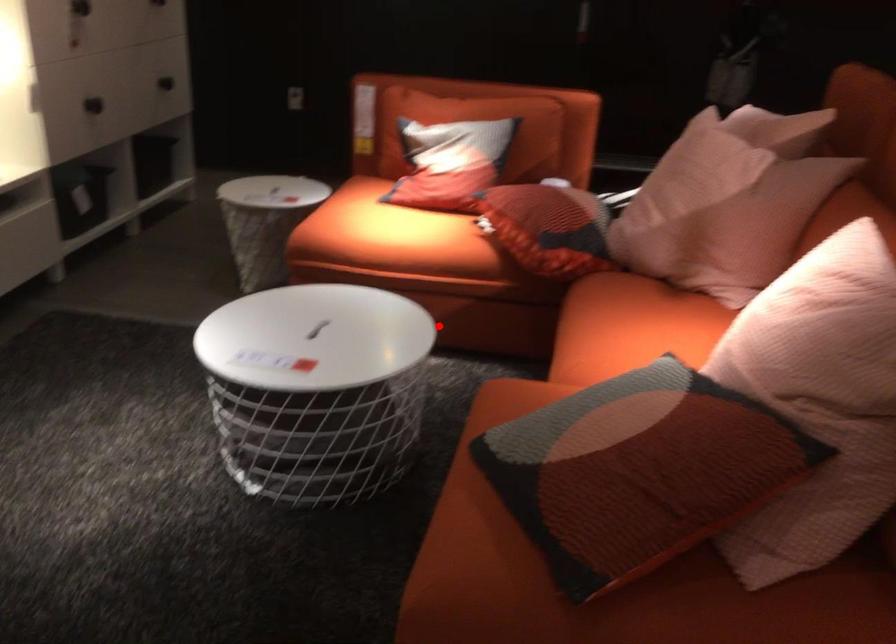
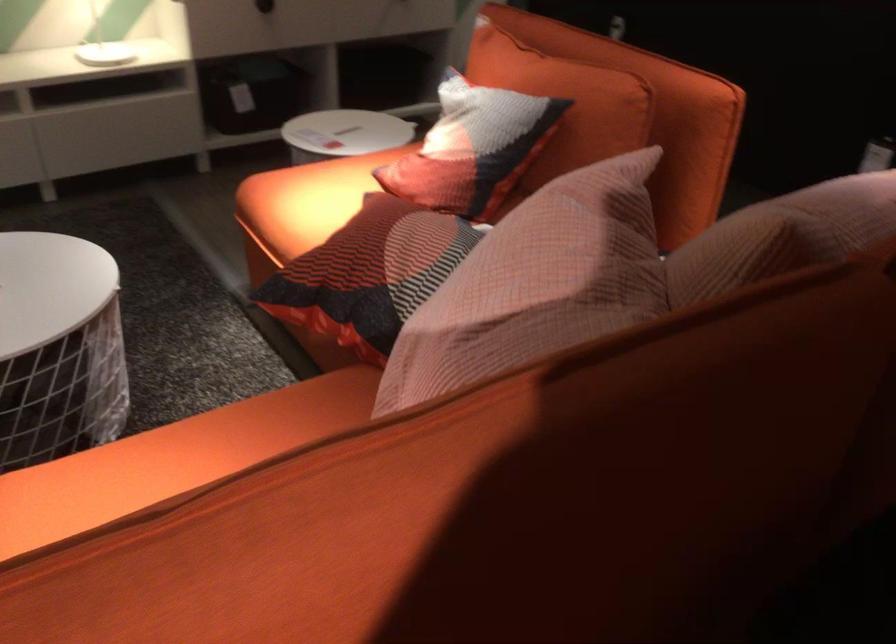
Where in the second image is the point corresponding to the highlighted location from the first image?

(322, 348)